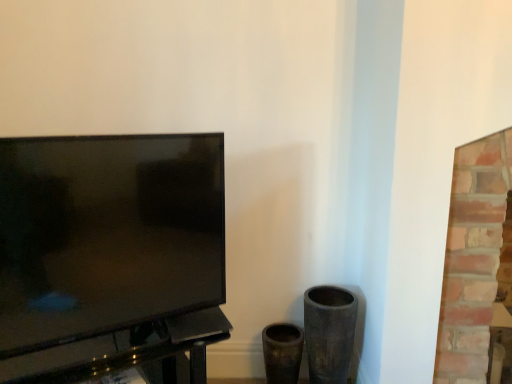
Measure the distance between point [507,153] and camera.

Point [507,153] is 1.29 meters from camera.

Locate an element on the screen. The height and width of the screenshot is (384, 512). black glossy table at left is located at coordinates (125, 352).

From the image's perspective, which object appears higher, brick fireplace at right or black glossy table at left?

brick fireplace at right appears higher in the image.

In the image, there is a brick fireplace at right. Where is `table below it (from the image's perspective)`? This screenshot has width=512, height=384. table below it (from the image's perspective) is located at coordinates (125, 352).

Is brick fireplace at right surrounding black glossy table at left?

Actually, black glossy table at left is outside brick fireplace at right.

How distant is brick fireplace at right from black glossy table at left?

36.39 inches.

In the image, is black glossy table at left on the left side or the right side of matte black tv at left?

black glossy table at left is positioned on matte black tv at left's left side.

Looking at the image, does black glossy table at left seem bigger or smaller compared to matte black tv at left?

In the image, black glossy table at left appears to be larger than matte black tv at left.

In the scene shown: From a real-world perspective, which is physically below, black glossy table at left or matte black tv at left?

From a 3D spatial view, black glossy table at left is below.

From their relative heights in the image, would you say black glossy table at left is taller or shorter than matte black tv at left?

In the image, black glossy table at left appears to be shorter than matte black tv at left.

Which of these two, matte black tv at left or brick fireplace at right, is thinner?

matte black tv at left is thinner.

Is point (174, 311) less distant than point (485, 369)?

Yes.

Considering the relative positions of matte black tv at left and brick fireplace at right in the image provided, is matte black tv at left to the right of brick fireplace at right from the viewer's perspective?

No.

Consider the image. From the image's perspective, is brick fireplace at right located above matte black tv at left?

Actually, brick fireplace at right appears below matte black tv at left in the image.

Considering the sizes of brick fireplace at right and matte black tv at left in the image, is brick fireplace at right bigger or smaller than matte black tv at left?

Considering their sizes, brick fireplace at right takes up more space than matte black tv at left.

Considering the positions of objects brick fireplace at right and matte black tv at left in the image provided, who is more to the right, brick fireplace at right or matte black tv at left?

From the viewer's perspective, brick fireplace at right appears more on the right side.

Is brick fireplace at right next to matte black tv at left and touching it?

They are not placed beside each other.

Which object is wider, matte black tv at left or black glossy table at left?

black glossy table at left.

Which is nearer, (71, 274) or (76, 375)?

Point (71, 274) is positioned closer to the camera compared to point (76, 375).

Which of these two, matte black tv at left or black glossy table at left, is smaller?

With smaller size is matte black tv at left.

What's the angular difference between matte black tv at left and black glossy table at left's facing directions?

The facing directions of matte black tv at left and black glossy table at left are 0.00132 degrees apart.

Consider the image. Would you say black glossy table at left is a long distance from brick fireplace at right?

They are positioned close to each other.

From a real-world perspective, which object rests below the other?

In real-world perspective, black glossy table at left is lower.

Can brick fireplace at right be found inside black glossy table at left?

No, brick fireplace at right is not inside black glossy table at left.

What are the coordinates of `table that is under the brick fireplace at right (from a real-world perspective)` in the screenshot? It's located at (125, 352).

Locate an element on the screen. The height and width of the screenshot is (384, 512). table below the matte black tv at left (from the image's perspective) is located at coordinates (125, 352).

Estimate the real-world distances between objects in this image. Which object is closer to brick fireplace at right, matte black tv at left or black glossy table at left?

black glossy table at left lies closer to brick fireplace at right than the other object.

Which object lies further to the anchor point black glossy table at left, matte black tv at left or brick fireplace at right?

brick fireplace at right lies further to black glossy table at left than the other object.

When comparing their distances from matte black tv at left, does brick fireplace at right or black glossy table at left seem further?

The object further to matte black tv at left is brick fireplace at right.

Based on their spatial positions, is black glossy table at left or matte black tv at left further from brick fireplace at right?

matte black tv at left.

From the image, which object appears to be nearer to matte black tv at left, black glossy table at left or brick fireplace at right?

black glossy table at left.

Based on their spatial positions, is brick fireplace at right or matte black tv at left closer to black glossy table at left?

matte black tv at left is closer to black glossy table at left.

Where is `television situated between black glossy table at left and brick fireplace at right from left to right`? The image size is (512, 384). television situated between black glossy table at left and brick fireplace at right from left to right is located at coordinates (106, 234).